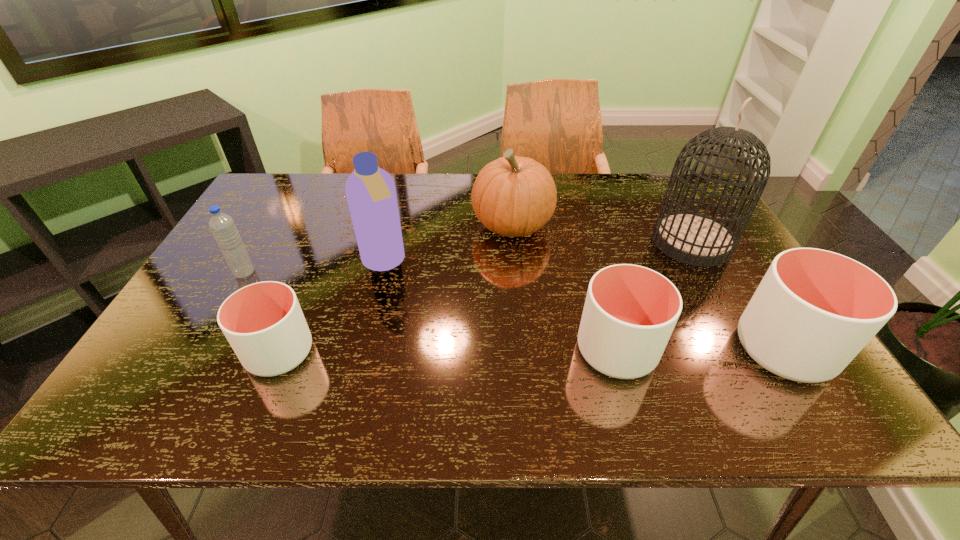
To ensure equal spacing by inserting another cup among them, please point out a vacant spot for this new cup. Please provide its 2D coordinates. Your answer should be formatted as a tuple, i.e. [(x, y)], where the tuple contains the x and y coordinates of a point satisfying the conditions above.

[(448, 351)]